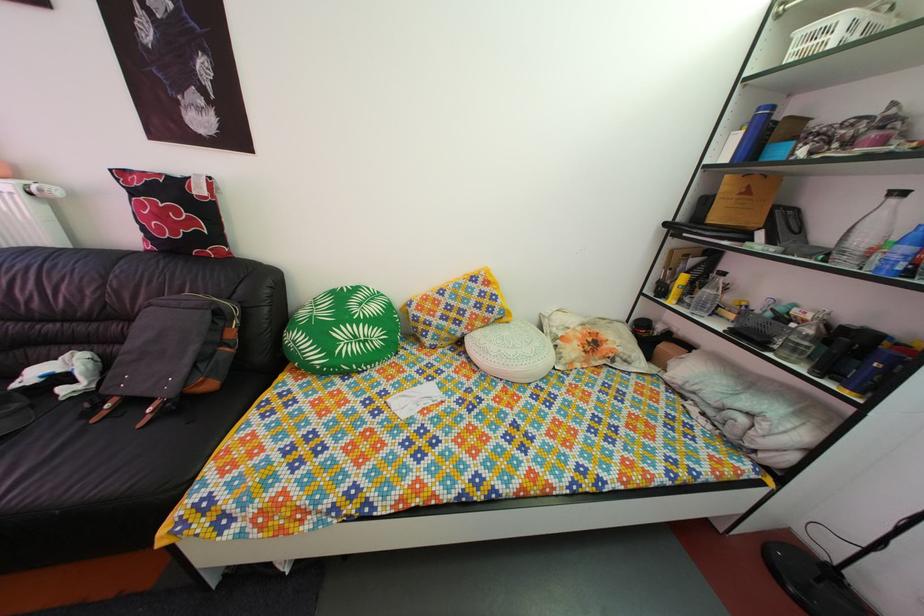
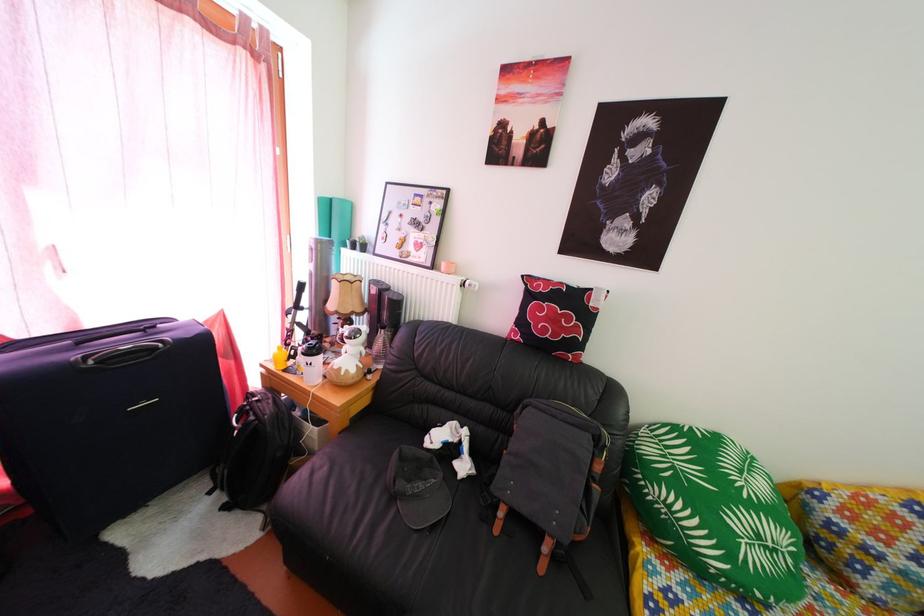
Find the pixel in the second image that matches (x=169, y=224) in the first image.

(562, 328)